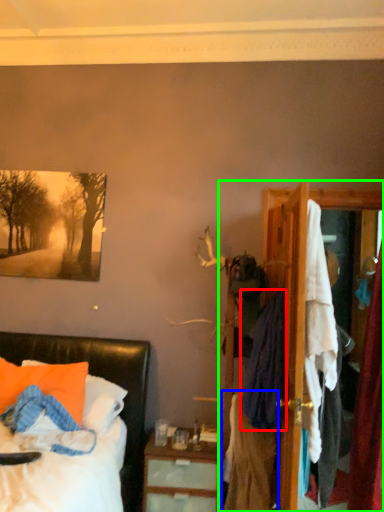
Question: Considering the real-world distances, which object is farthest from clothing (highlighted by a red box)? clothing (highlighted by a blue box) or dresser (highlighted by a green box)?

Choices:
 (A) clothing
 (B) dresser

Answer: (A)